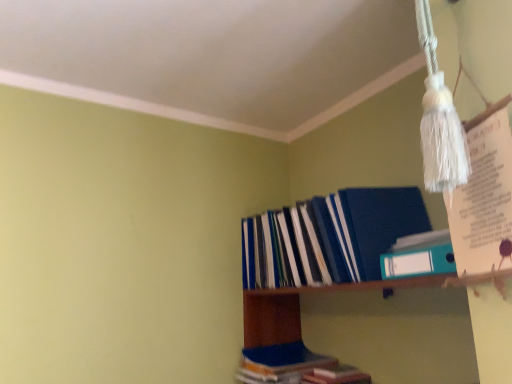
Question: Would you say blue plastic folder at upper right contains blue hardcover book at lower center, positioned as the first book in bottom-to-top order?

Choices:
 (A) no
 (B) yes

Answer: (B)

Question: From a real-world perspective, is blue plastic folder at upper right positioned under blue hardcover book at lower center, positioned as the first book in bottom-to-top order, based on gravity?

Choices:
 (A) no
 (B) yes

Answer: (A)

Question: Is blue plastic folder at upper right oriented towards blue hardcover book at lower center, the 3th book from the top?

Choices:
 (A) yes
 (B) no

Answer: (A)

Question: Can you confirm if blue plastic folder at upper right is thinner than blue hardcover book at lower center, the 3th book from the top?

Choices:
 (A) no
 (B) yes

Answer: (B)

Question: Is blue plastic folder at upper right far from blue hardcover book at lower center, positioned as the first book in bottom-to-top order?

Choices:
 (A) yes
 (B) no

Answer: (B)

Question: From a real-world perspective, is teal plastic ring binder at upper right, the 1th book from the top, positioned above or below blue matte folder at upper right, which ranks as the 2th book in top-to-bottom order?

Choices:
 (A) above
 (B) below

Answer: (B)

Question: From the image's perspective, is teal plastic ring binder at upper right, the 1th book from the top, positioned above or below blue matte folder at upper right, which ranks as the 2th book in top-to-bottom order?

Choices:
 (A) above
 (B) below

Answer: (A)

Question: Is teal plastic ring binder at upper right, the third book ordered from the bottom, taller or shorter than blue matte folder at upper right, which ranks as the 2th book in top-to-bottom order?

Choices:
 (A) short
 (B) tall

Answer: (A)

Question: Which is correct: teal plastic ring binder at upper right, the 1th book from the top, is inside blue matte folder at upper right, which ranks as the 2th book in top-to-bottom order, or outside of it?

Choices:
 (A) inside
 (B) outside

Answer: (B)

Question: From a real-world perspective, is blue hardcover book at lower center, positioned as the first book in bottom-to-top order, physically located above or below blue plastic folder at upper right?

Choices:
 (A) below
 (B) above

Answer: (A)

Question: Does point (308, 372) appear closer or farther from the camera than point (353, 302)?

Choices:
 (A) closer
 (B) farther

Answer: (A)

Question: From the image's perspective, is blue hardcover book at lower center, the 3th book from the top, located above or below blue plastic folder at upper right?

Choices:
 (A) below
 (B) above

Answer: (A)

Question: Visually, is blue hardcover book at lower center, the 3th book from the top, positioned to the left or to the right of blue plastic folder at upper right?

Choices:
 (A) left
 (B) right

Answer: (A)

Question: Is blue plastic folder at upper right in front of or behind teal plastic ring binder at upper right, the third book ordered from the bottom, in the image?

Choices:
 (A) behind
 (B) front

Answer: (B)

Question: In terms of width, does blue plastic folder at upper right look wider or thinner when compared to teal plastic ring binder at upper right, the 1th book from the top?

Choices:
 (A) wide
 (B) thin

Answer: (A)